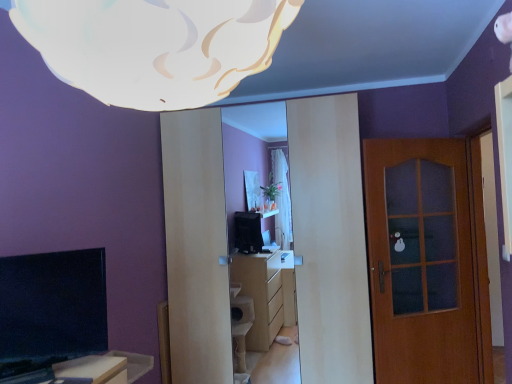
Question: Is white matte cloud at upper center located outside brown wooden door at right?

Choices:
 (A) no
 (B) yes

Answer: (B)

Question: Considering the relative sizes of white matte cloud at upper center and brown wooden door at right in the image provided, is white matte cloud at upper center smaller than brown wooden door at right?

Choices:
 (A) no
 (B) yes

Answer: (B)

Question: Is white matte cloud at upper center at the left side of brown wooden door at right?

Choices:
 (A) no
 (B) yes

Answer: (B)

Question: Could brown wooden door at right be considered to be inside white matte cloud at upper center?

Choices:
 (A) no
 (B) yes

Answer: (A)

Question: Considering the relative sizes of white matte cloud at upper center and brown wooden door at right in the image provided, is white matte cloud at upper center wider than brown wooden door at right?

Choices:
 (A) no
 (B) yes

Answer: (B)

Question: Considering the relative positions of white matte cloud at upper center and brown wooden door at right in the image provided, is white matte cloud at upper center behind brown wooden door at right?

Choices:
 (A) no
 (B) yes

Answer: (A)

Question: Is brown wooden door at right positioned beyond the bounds of white matte cloud at upper center?

Choices:
 (A) no
 (B) yes

Answer: (B)

Question: Is the depth of brown wooden door at right less than that of white matte cloud at upper center?

Choices:
 (A) no
 (B) yes

Answer: (A)

Question: From a real-world perspective, does brown wooden door at right sit lower than white matte cloud at upper center?

Choices:
 (A) no
 (B) yes

Answer: (B)

Question: Considering the relative sizes of brown wooden door at right and white matte cloud at upper center in the image provided, is brown wooden door at right wider than white matte cloud at upper center?

Choices:
 (A) no
 (B) yes

Answer: (A)

Question: Does brown wooden door at right have a smaller size compared to white matte cloud at upper center?

Choices:
 (A) yes
 (B) no

Answer: (B)

Question: From the image's perspective, does brown wooden door at right appear lower than white matte cloud at upper center?

Choices:
 (A) no
 (B) yes

Answer: (B)

Question: Is point (472, 297) positioned closer to the camera than point (292, 18)?

Choices:
 (A) farther
 (B) closer

Answer: (A)